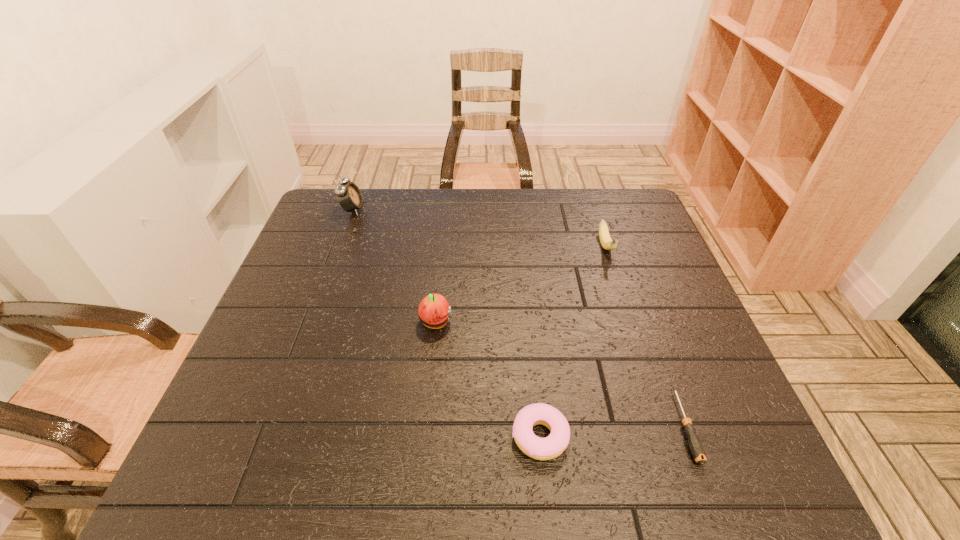
Find the location of a particular element. free location located on the face of the farthest object is located at coordinates (440, 210).

Find the location of a particular element. vacant area situated on the front of the fourth object from right to left is located at coordinates (431, 369).

Image resolution: width=960 pixels, height=540 pixels. I want to click on free space located at the stem of the second object from right to left, so click(x=636, y=341).

Find the location of `vacant space positioned 0.170m on the back of the doughnut`. vacant space positioned 0.170m on the back of the doughnut is located at coordinates (530, 343).

In order to click on vacant space situated on the back of the rightmost object in this screenshot , I will do `click(628, 268)`.

This screenshot has height=540, width=960. I want to click on alarm clock at the far edge, so click(349, 196).

The height and width of the screenshot is (540, 960). Find the location of `banana that is at the far edge`. banana that is at the far edge is located at coordinates (607, 243).

You are a GUI agent. You are given a task and a screenshot of the screen. Output one action in this format:
    pyautogui.click(x=<x>, y=<y>)
    Task: Click on the doughnut located in the near edge section of the desktop
    
    Given the screenshot: What is the action you would take?
    pyautogui.click(x=552, y=446)

Image resolution: width=960 pixels, height=540 pixels. Identify the location of screwdriver located at the near edge. (696, 447).

Locate an element on the screen. Image resolution: width=960 pixels, height=540 pixels. object that is positioned at the left edge is located at coordinates (349, 196).